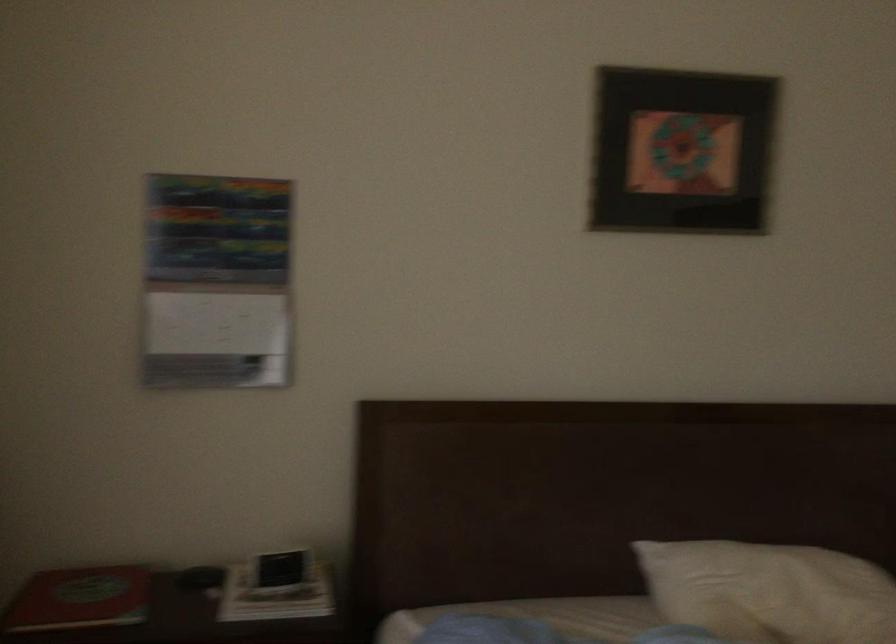
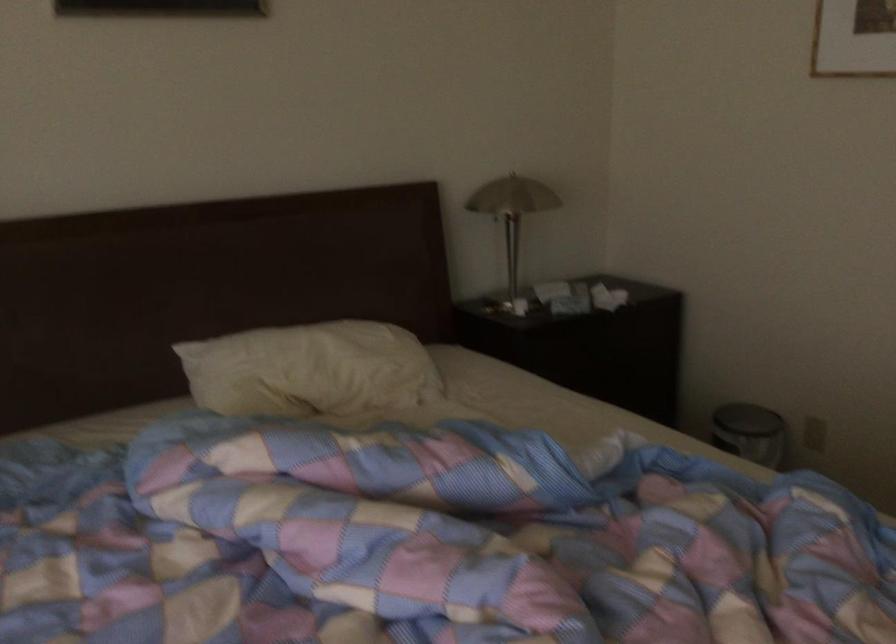
Question: The camera is either moving clockwise (left) or counter-clockwise (right) around the object. The first image is from the beginning of the video and the second image is from the end. Is the camera moving left or right when shooting the video?

Choices:
 (A) Left
 (B) Right

Answer: (A)